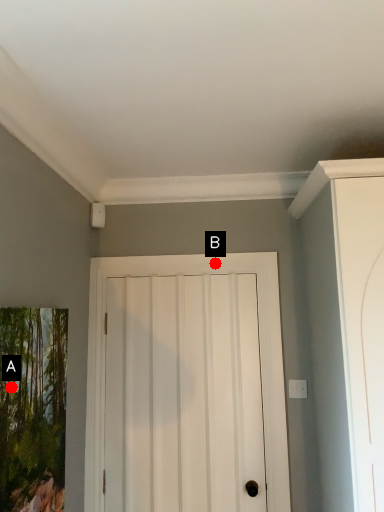
Question: Two points are circled on the image, labeled by A and B beside each circle. Which point is closer to the camera taking this photo?

Choices:
 (A) A is closer
 (B) B is closer

Answer: (A)